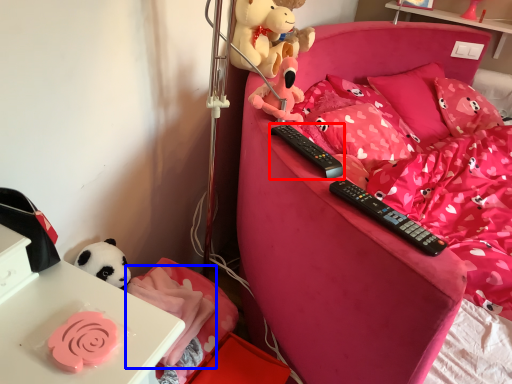
Question: Which point is closer to the camera, remote control (highlighted by a red box) or blanket (highlighted by a blue box)?

Choices:
 (A) remote control
 (B) blanket

Answer: (A)